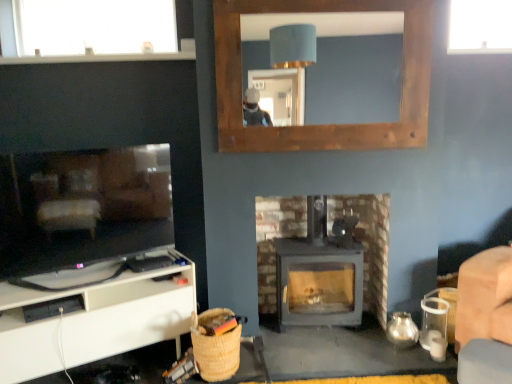
Identify the location of matte gray wood stove at center. The image size is (512, 384). (369, 243).

This screenshot has width=512, height=384. What do you see at coordinates (369, 243) in the screenshot? I see `matte gray wood stove at center` at bounding box center [369, 243].

The image size is (512, 384). Describe the element at coordinates (89, 31) in the screenshot. I see `transparent glass window at upper left, arranged as the first window when viewed from the left` at that location.

Describe the element at coordinates (215, 347) in the screenshot. The height and width of the screenshot is (384, 512). I see `woven straw basket at lower left` at that location.

What do you see at coordinates (480, 27) in the screenshot? The image size is (512, 384). I see `transparent glass window at upper right, placed as the first window when sorted from right to left` at bounding box center [480, 27].

Find the location of `matte gray wood stove at center`. matte gray wood stove at center is located at coordinates (369, 243).

What's the angular difference between transparent glass window at upper right, placed as the first window when sorted from right to left, and matte gray wood stove at center's facing directions?

The angular difference between transparent glass window at upper right, placed as the first window when sorted from right to left, and matte gray wood stove at center is 1.32 degrees.

Which is in front, point (503, 15) or point (258, 200)?

The point (503, 15) is more forward.

Based on the photo, is transparent glass window at upper right, placed as the first window when sorted from right to left, wider or thinner than matte gray wood stove at center?

transparent glass window at upper right, placed as the first window when sorted from right to left, is thinner than matte gray wood stove at center.

Identify the location of window above the transparent glass window at upper left, arranged as the first window when viewed from the left (from the image's perspective). (480, 27).

Could you tell me if transparent glass window at upper right, placed as the first window when sorted from right to left, is turned towards transparent glass window at upper left, arranged as the first window when viewed from the left?

No, transparent glass window at upper right, placed as the first window when sorted from right to left, does not turn towards transparent glass window at upper left, arranged as the first window when viewed from the left.

Based on the photo, is transparent glass window at upper right, placed as the first window when sorted from right to left, wider than transparent glass window at upper left, arranged as the first window when viewed from the left?

Yes.

How much distance is there between transparent glass window at upper right, placed as the second window when sorted from left to right, and transparent glass window at upper left, the second window viewed from the right?

The distance of transparent glass window at upper right, placed as the second window when sorted from left to right, from transparent glass window at upper left, the second window viewed from the right, is 2.03 meters.

Is white matte cabinet at lower left not close to transparent glass window at upper right, placed as the first window when sorted from right to left?

Indeed, white matte cabinet at lower left is not near transparent glass window at upper right, placed as the first window when sorted from right to left.

From the image's perspective, does white matte cabinet at lower left appear lower than transparent glass window at upper right, placed as the first window when sorted from right to left?

Yes.

Is white matte cabinet at lower left located outside transparent glass window at upper right, placed as the second window when sorted from left to right?

Yes, white matte cabinet at lower left is located beyond the bounds of transparent glass window at upper right, placed as the second window when sorted from left to right.

From a real-world perspective, is white matte cabinet at lower left positioned over transparent glass window at upper right, placed as the second window when sorted from left to right, based on gravity?

No.

Is transparent glass window at upper left, the second window viewed from the right, in contact with woven straw basket at lower left?

No, transparent glass window at upper left, the second window viewed from the right, is not making contact with woven straw basket at lower left.

Is transparent glass window at upper left, the second window viewed from the right, in front of woven straw basket at lower left?

No, the depth of transparent glass window at upper left, the second window viewed from the right, is greater than that of woven straw basket at lower left.

Between transparent glass window at upper left, the second window viewed from the right, and woven straw basket at lower left, which one has smaller width?

transparent glass window at upper left, the second window viewed from the right, is thinner.

From the picture: Is wooden frame mirror at upper center looking in the opposite direction of woven straw basket at lower left?

No, wooden frame mirror at upper center's orientation is not away from woven straw basket at lower left.

From the image's perspective, which one is positioned lower, wooden frame mirror at upper center or woven straw basket at lower left?

woven straw basket at lower left is shown below in the image.

Is wooden frame mirror at upper center completely or partially outside of woven straw basket at lower left?

Yes, wooden frame mirror at upper center is located beyond the bounds of woven straw basket at lower left.

Is wooden frame mirror at upper center with woven straw basket at lower left?

wooden frame mirror at upper center and woven straw basket at lower left are not in contact.

Which object is positioned more to the left, matte gray wood stove at center or transparent glass window at upper right, placed as the second window when sorted from left to right?

matte gray wood stove at center.

Can you tell me how much matte gray wood stove at center and transparent glass window at upper right, placed as the second window when sorted from left to right, differ in facing direction?

The facing directions of matte gray wood stove at center and transparent glass window at upper right, placed as the second window when sorted from left to right, are 1.32 degrees apart.

Could you tell me if matte gray wood stove at center is facing transparent glass window at upper right, placed as the second window when sorted from left to right?

No, matte gray wood stove at center does not turn towards transparent glass window at upper right, placed as the second window when sorted from left to right.

From a real-world perspective, which is physically below, matte gray wood stove at center or transparent glass window at upper right, placed as the second window when sorted from left to right?

matte gray wood stove at center, from a real-world perspective.

From a real-world perspective, relative to matte gray wood stove at center, is woven straw basket at lower left vertically above or below?

woven straw basket at lower left is situated lower than matte gray wood stove at center in the real world.

Measure the distance between woven straw basket at lower left and matte gray wood stove at center.

The distance of woven straw basket at lower left from matte gray wood stove at center is 30.40 inches.

Is woven straw basket at lower left shorter than matte gray wood stove at center?

Indeed, woven straw basket at lower left has a lesser height compared to matte gray wood stove at center.

From a real-world perspective, starting from the matte gray wood stove at center, which window is the 1st one vertically above it? Please provide its 2D coordinates.

[(480, 27)]

What are the coordinates of `window in front of the transparent glass window at upper right, placed as the first window when sorted from right to left` in the screenshot? It's located at (89, 31).

When comparing their distances from wooden frame mirror at upper center, does transparent glass window at upper left, arranged as the first window when viewed from the left, or white matte cabinet at lower left seem closer?

transparent glass window at upper left, arranged as the first window when viewed from the left, is positioned closer to the anchor wooden frame mirror at upper center.

Looking at the image, which one is located closer to transparent glass window at upper left, arranged as the first window when viewed from the left, transparent glass window at upper right, placed as the second window when sorted from left to right, or woven straw basket at lower left?

woven straw basket at lower left lies closer to transparent glass window at upper left, arranged as the first window when viewed from the left, than the other object.

Looking at the image, which one is located further to transparent glass window at upper left, arranged as the first window when viewed from the left, woven straw basket at lower left or matte gray wood stove at center?

woven straw basket at lower left is further to transparent glass window at upper left, arranged as the first window when viewed from the left.

Estimate the real-world distances between objects in this image. Which object is closer to transparent glass window at upper right, placed as the first window when sorted from right to left, wooden frame mirror at upper center or woven straw basket at lower left?

wooden frame mirror at upper center.

When comparing their distances from white matte cabinet at lower left, does wooden frame mirror at upper center or transparent glass window at upper right, placed as the second window when sorted from left to right, seem closer?

wooden frame mirror at upper center lies closer to white matte cabinet at lower left than the other object.

Estimate the real-world distances between objects in this image. Which object is further from wooden frame mirror at upper center, matte gray wood stove at center or woven straw basket at lower left?

woven straw basket at lower left.

In the scene shown: When comparing their distances from matte gray wood stove at center, does wooden frame mirror at upper center or transparent glass window at upper right, placed as the first window when sorted from right to left, seem closer?

Based on the image, wooden frame mirror at upper center appears to be nearer to matte gray wood stove at center.

From the image, which object appears to be farther from transparent glass window at upper right, placed as the second window when sorted from left to right, woven straw basket at lower left or wooden frame mirror at upper center?

woven straw basket at lower left is positioned further to the anchor transparent glass window at upper right, placed as the second window when sorted from left to right.

The width and height of the screenshot is (512, 384). I want to click on mirror between transparent glass window at upper left, the second window viewed from the right, and white matte cabinet at lower left vertically, so click(328, 68).

Image resolution: width=512 pixels, height=384 pixels. Find the location of `fireplace between white matte cabinet at lower left and transparent glass window at upper right, placed as the second window when sorted from left to right`. fireplace between white matte cabinet at lower left and transparent glass window at upper right, placed as the second window when sorted from left to right is located at coordinates (369, 243).

The width and height of the screenshot is (512, 384). What are the coordinates of `basket between transparent glass window at upper left, arranged as the first window when viewed from the left, and transparent glass window at upper right, placed as the first window when sorted from right to left` in the screenshot? It's located at (215, 347).

Where is `cabinetry between transparent glass window at upper left, arranged as the first window when viewed from the left, and transparent glass window at upper right, placed as the first window when sorted from right to left, from left to right`? The width and height of the screenshot is (512, 384). cabinetry between transparent glass window at upper left, arranged as the first window when viewed from the left, and transparent glass window at upper right, placed as the first window when sorted from right to left, from left to right is located at coordinates (94, 316).